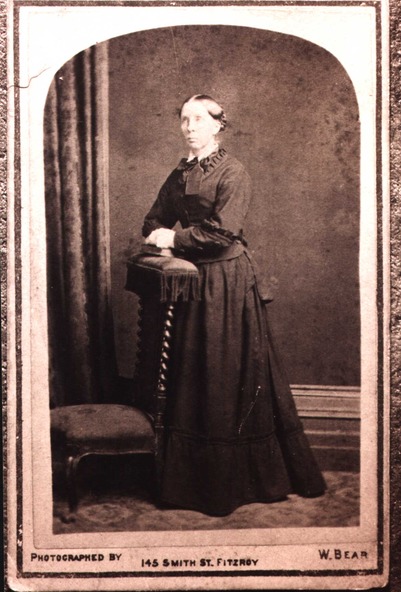
Image resolution: width=401 pixels, height=592 pixels. I want to click on chair back (really high), so click(150, 342).